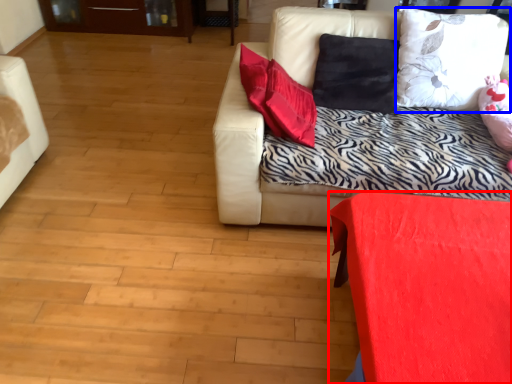
Question: Which of the following is the closest to the observer, furniture (highlighted by a red box) or pillow (highlighted by a blue box)?

Choices:
 (A) furniture
 (B) pillow

Answer: (A)